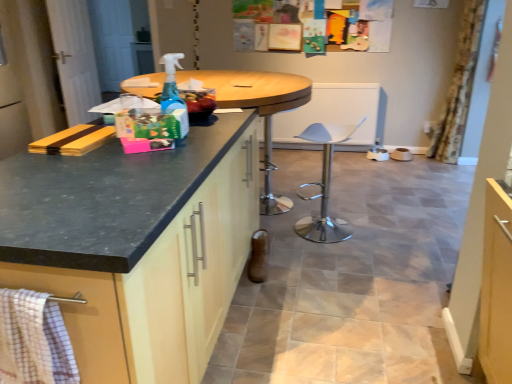
Image resolution: width=512 pixels, height=384 pixels. What are the coordinates of `free space to the left of white plastic swivel chair at center` in the screenshot? It's located at (279, 233).